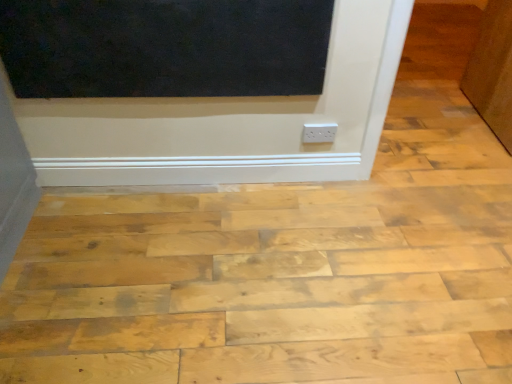
Question: From the image's perspective, is brown matte door at upper right on natural wood plywood at center?

Choices:
 (A) no
 (B) yes

Answer: (B)

Question: Considering the relative sizes of brown matte door at upper right and natural wood plywood at center in the image provided, is brown matte door at upper right smaller than natural wood plywood at center?

Choices:
 (A) yes
 (B) no

Answer: (A)

Question: Is brown matte door at upper right located outside natural wood plywood at center?

Choices:
 (A) yes
 (B) no

Answer: (A)

Question: Are brown matte door at upper right and natural wood plywood at center beside each other?

Choices:
 (A) no
 (B) yes

Answer: (A)

Question: Does brown matte door at upper right have a greater height compared to natural wood plywood at center?

Choices:
 (A) no
 (B) yes

Answer: (B)

Question: Is white plastic outlet at center spatially inside natural wood plywood at center, or outside of it?

Choices:
 (A) outside
 (B) inside

Answer: (A)

Question: From the image's perspective, is white plastic outlet at center located above or below natural wood plywood at center?

Choices:
 (A) below
 (B) above

Answer: (B)

Question: Considering the positions of white plastic outlet at center and natural wood plywood at center in the image, is white plastic outlet at center bigger or smaller than natural wood plywood at center?

Choices:
 (A) small
 (B) big

Answer: (A)

Question: Relative to natural wood plywood at center, is white plastic outlet at center in front or behind?

Choices:
 (A) behind
 (B) front

Answer: (A)

Question: Looking at their shapes, would you say natural wood plywood at center is wider or thinner than matte black screen door at upper center?

Choices:
 (A) thin
 (B) wide

Answer: (B)

Question: Is natural wood plywood at center taller or shorter than matte black screen door at upper center?

Choices:
 (A) short
 (B) tall

Answer: (A)

Question: From the image's perspective, relative to matte black screen door at upper center, is natural wood plywood at center above or below?

Choices:
 (A) below
 (B) above

Answer: (A)

Question: Relative to matte black screen door at upper center, is natural wood plywood at center in front or behind?

Choices:
 (A) behind
 (B) front

Answer: (B)

Question: In terms of width, does brown matte door at upper right look wider or thinner when compared to white plastic outlet at center?

Choices:
 (A) wide
 (B) thin

Answer: (A)

Question: From the image's perspective, is brown matte door at upper right positioned above or below white plastic outlet at center?

Choices:
 (A) above
 (B) below

Answer: (A)